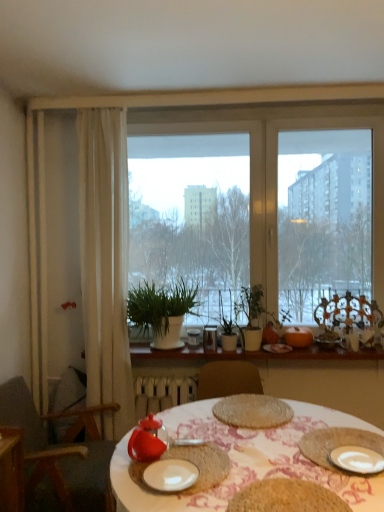
Where is `free space in front of white matte plate at center, which ranks as the 2th plate in right-to-left order`? This screenshot has height=512, width=384. free space in front of white matte plate at center, which ranks as the 2th plate in right-to-left order is located at coordinates (183, 500).